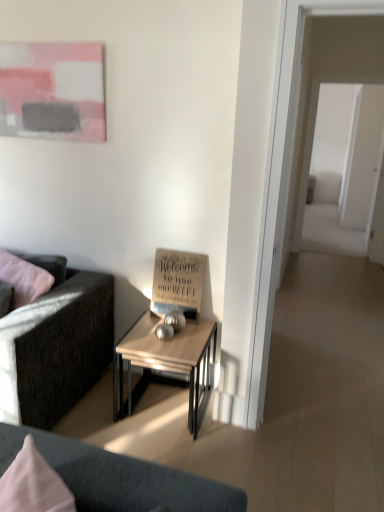
Identify the location of free space to the left of wooden table at center. (92, 410).